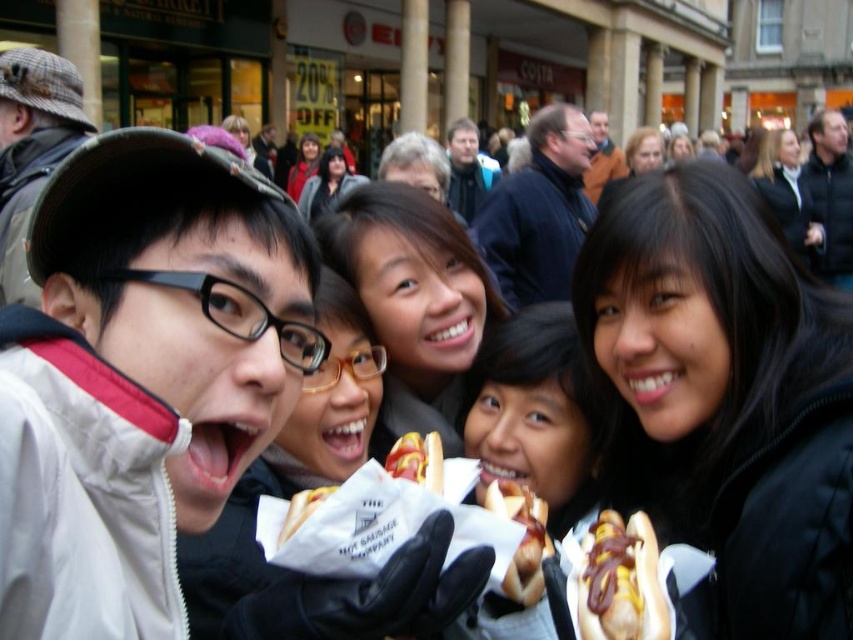
You are a photographer taking a picture of the shiny brown hot dog at center and the smooth yellow hot dog at center. Which hot dog will appear more prominent in the photo?

The shiny brown hot dog at center will appear more prominent in the photo because it is positioned in front of the smooth yellow hot dog at center.

You are a food vendor at the event and need to arrange the golden brown bun at center and the white paper hot dog at center on a display. Which object should you place higher on the shelf to ensure proper visibility?

The golden brown bun at center should be placed higher on the shelf since it has a greater height compared to the white paper hot dog at center, ensuring both items are visible without one blocking the other.